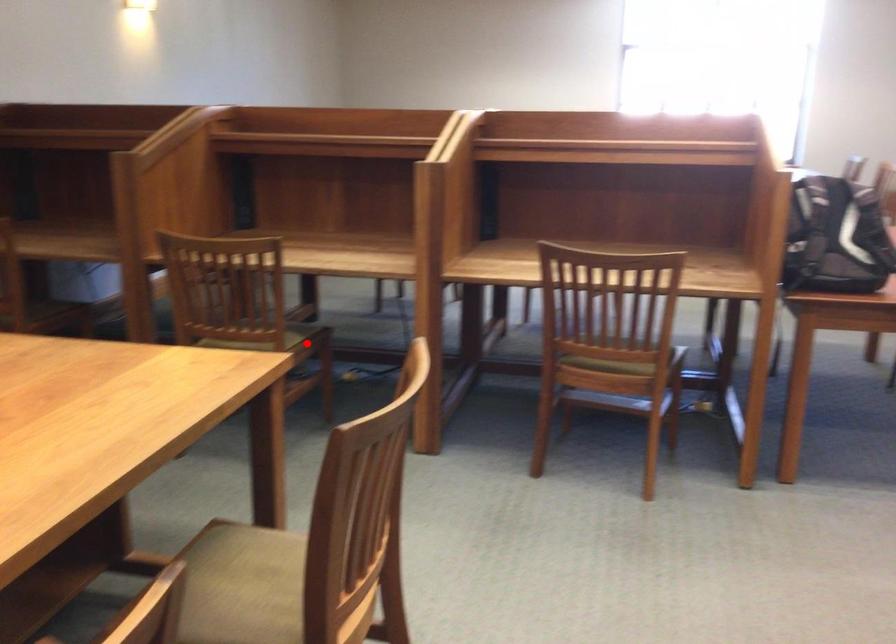
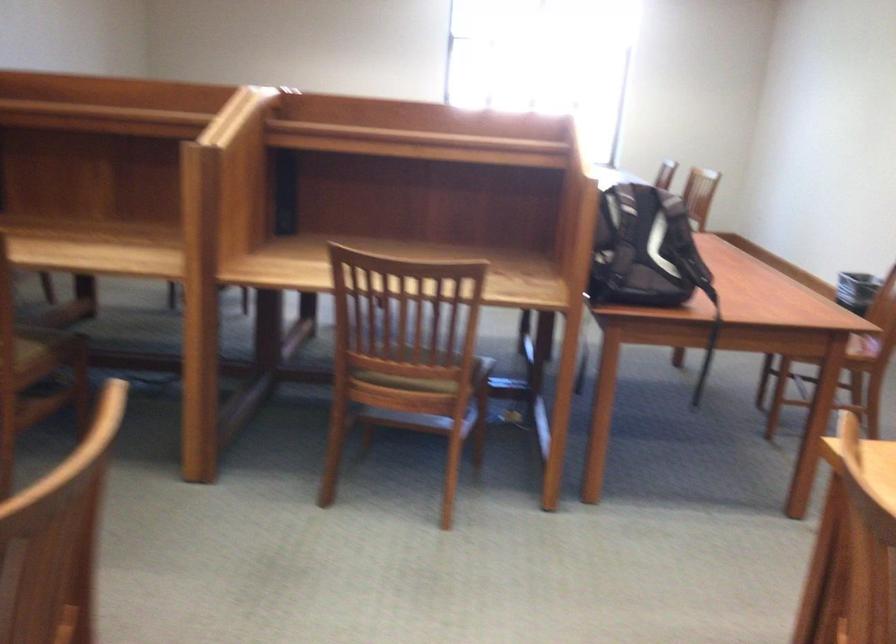
Question: A red point is marked in image1. In image2, is the corresponding 3D point closer to the camera or farther? Reply with the corresponding letter.

Choices:
 (A) The corresponding 3D point is closer.
 (B) The corresponding 3D point is farther.

Answer: (A)